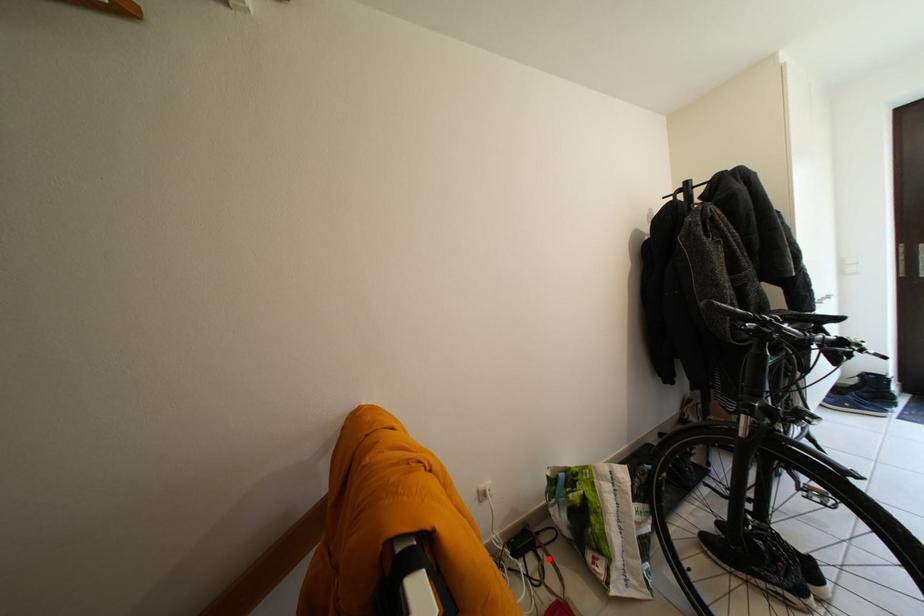
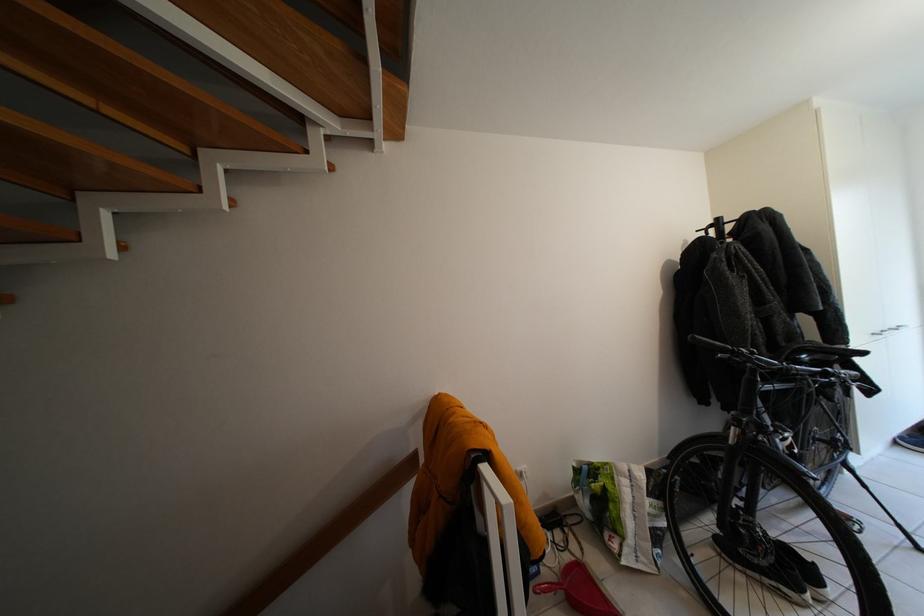
Locate, in the second image, the point that corresponds to the highlighted location in the first image.

(575, 535)